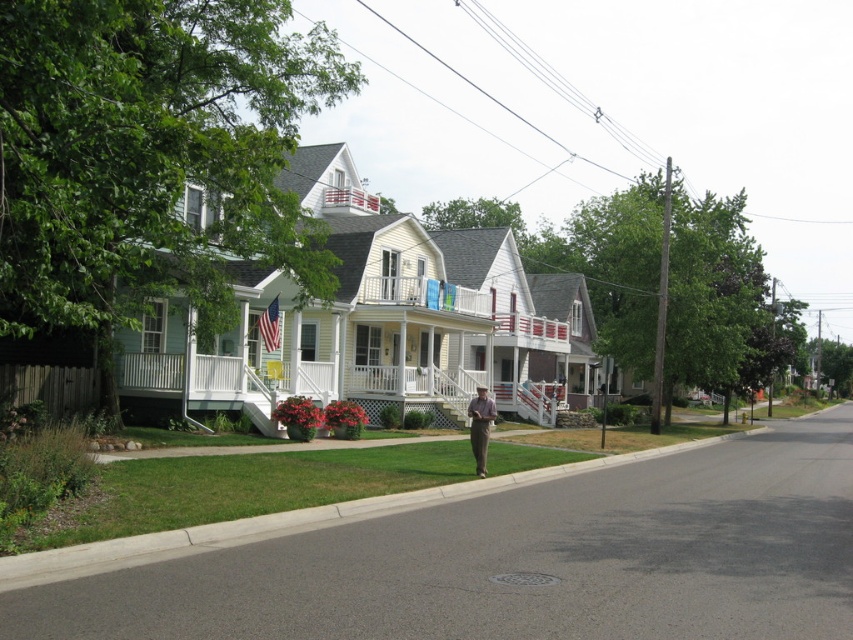
Can you confirm if gray concrete curb at lower center is shorter than light brown pants at center?

Indeed, gray concrete curb at lower center has a lesser height compared to light brown pants at center.

Is point (136, 536) more distant than point (476, 401)?

No, it is not.

The height and width of the screenshot is (640, 853). Identify the location of gray concrete curb at lower center. (292, 520).